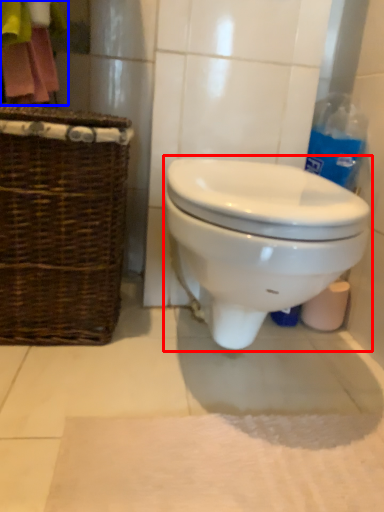
Question: Which object is closer to the camera taking this photo, toilet (highlighted by a red box) or laundry (highlighted by a blue box)?

Choices:
 (A) toilet
 (B) laundry

Answer: (A)